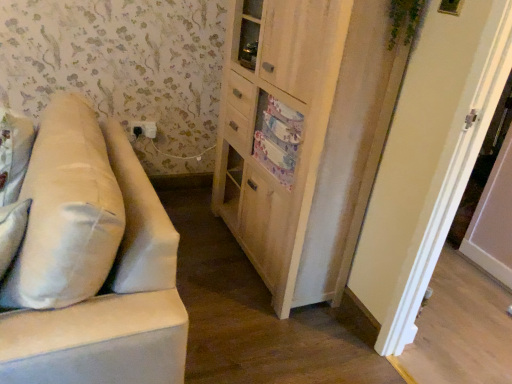
Question: Is beige fabric couch at left spatially inside black plastic outlet at upper left, or outside of it?

Choices:
 (A) outside
 (B) inside

Answer: (A)

Question: Looking at the image, does beige fabric couch at left seem bigger or smaller compared to black plastic outlet at upper left?

Choices:
 (A) big
 (B) small

Answer: (A)

Question: Estimate the real-world distances between objects in this image. Which object is farther from the beige fabric couch at left?

Choices:
 (A) wooden cabinet at center
 (B) white fabric pillow at left
 (C) white painted wood door at right
 (D) black plastic outlet at upper left

Answer: (D)

Question: Which object is positioned farthest from the beige fabric couch at left?

Choices:
 (A) wooden cabinet at center
 (B) white painted wood door at right
 (C) white fabric pillow at left
 (D) black plastic outlet at upper left

Answer: (D)